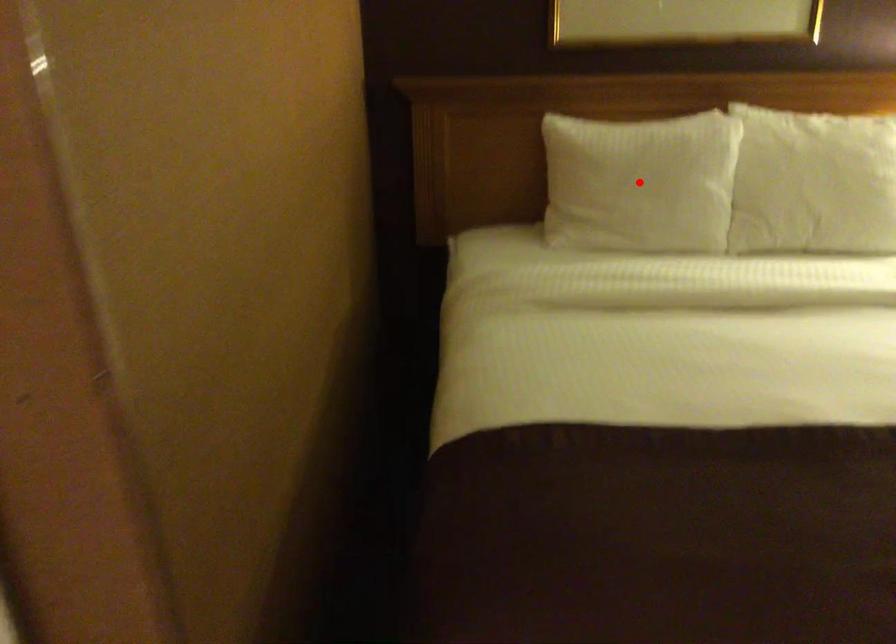
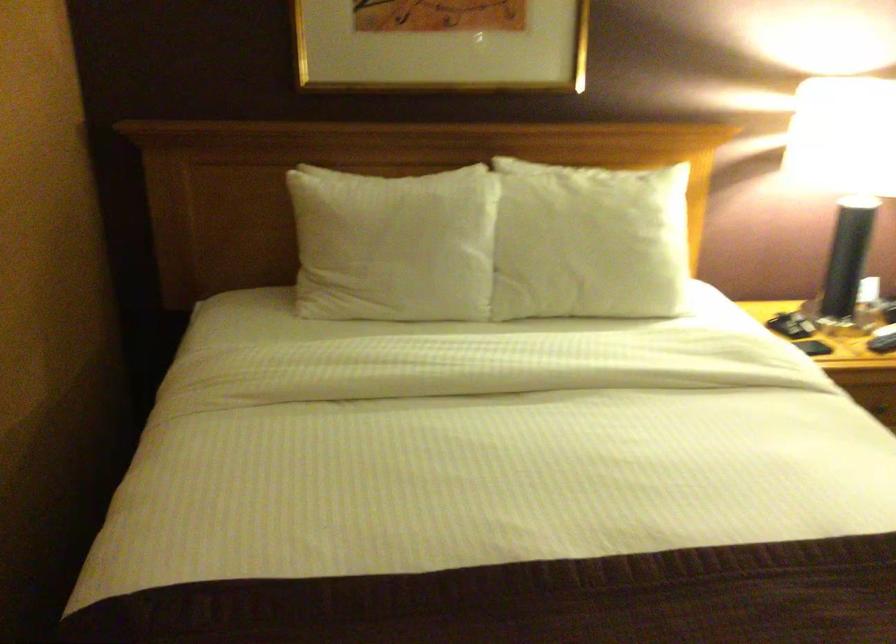
Find the pixel in the second image that matches the highlighted location in the first image.

(393, 245)